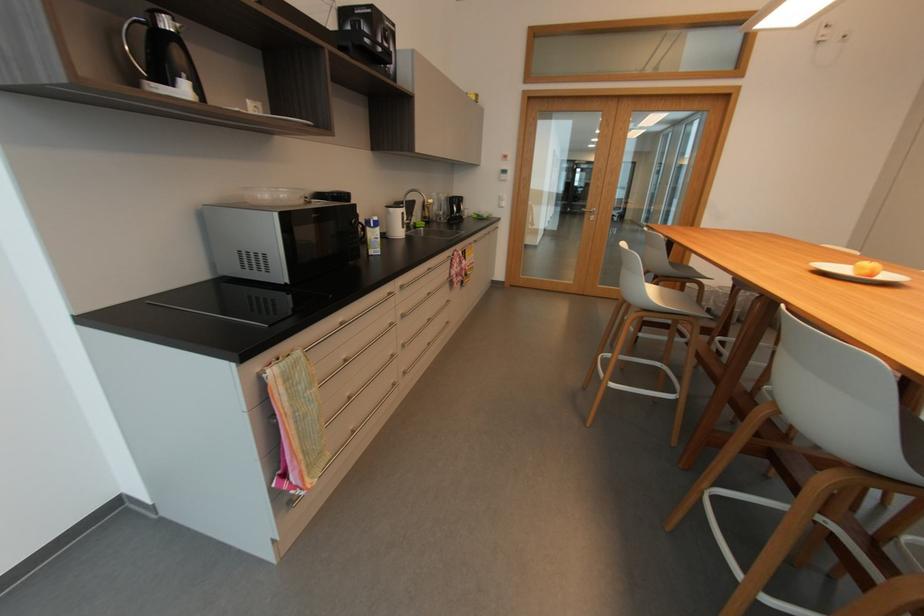
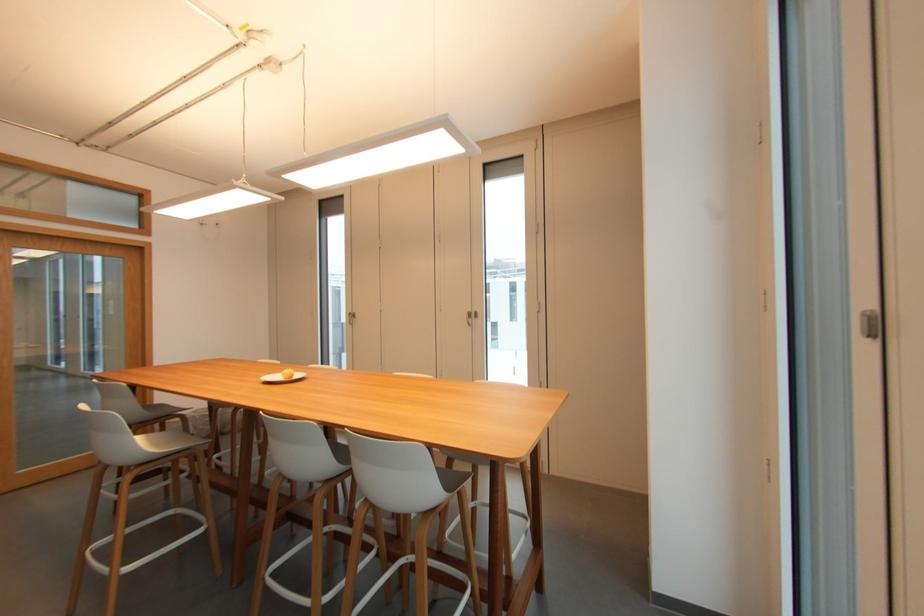
Question: The camera is either moving clockwise (left) or counter-clockwise (right) around the object. The first image is from the beginning of the video and the second image is from the end. Is the camera moving left or right when shooting the video?

Choices:
 (A) Left
 (B) Right

Answer: (A)